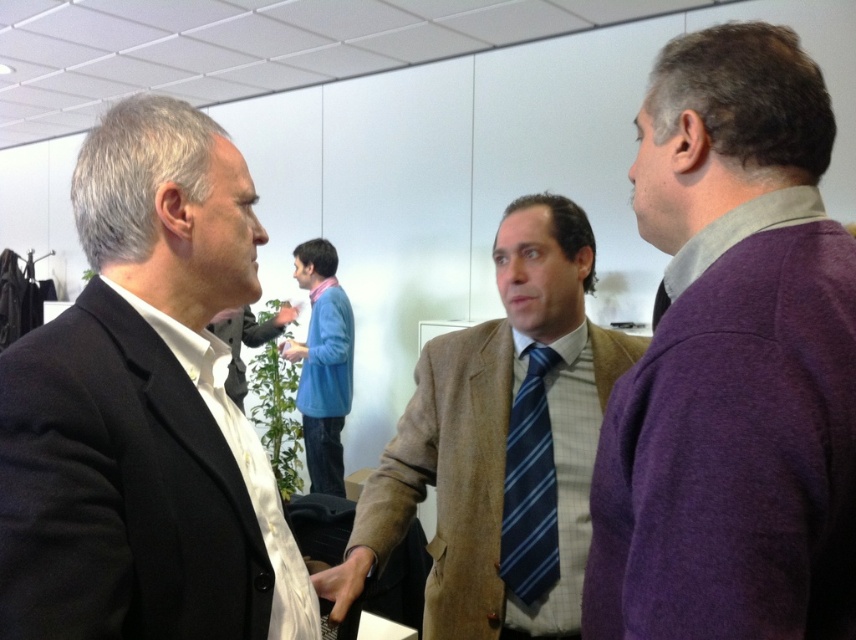
Question: Which point is closer to the camera?

Choices:
 (A) (351, 337)
 (B) (806, 84)

Answer: (B)

Question: Can you confirm if black matte suit at left is thinner than matte black camera at center?

Choices:
 (A) no
 (B) yes

Answer: (B)

Question: Among these objects, which one is nearest to the camera?

Choices:
 (A) blue striped tie at center
 (B) black matte suit at left
 (C) blue fleece sweater at center

Answer: (B)

Question: Is black matte suit at left bigger than blue fleece sweater at center?

Choices:
 (A) yes
 (B) no

Answer: (B)

Question: Which point appears farthest from the camera in this image?

Choices:
 (A) (268, 326)
 (B) (218, 148)
 (C) (541, 388)
 (D) (319, 252)

Answer: (A)

Question: Does blue striped tie at center appear under matte black camera at center?

Choices:
 (A) no
 (B) yes

Answer: (B)